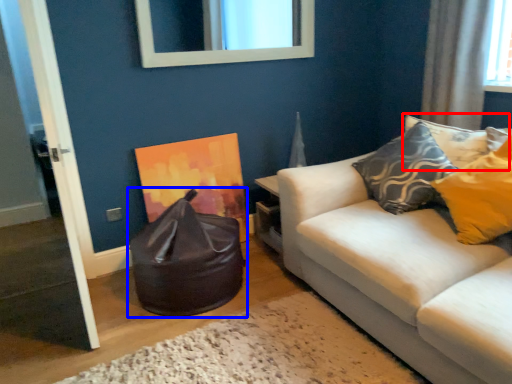
Question: Which of the following is the closest to the observer, pillow (highlighted by a red box) or bean bag chair (highlighted by a blue box)?

Choices:
 (A) pillow
 (B) bean bag chair

Answer: (B)